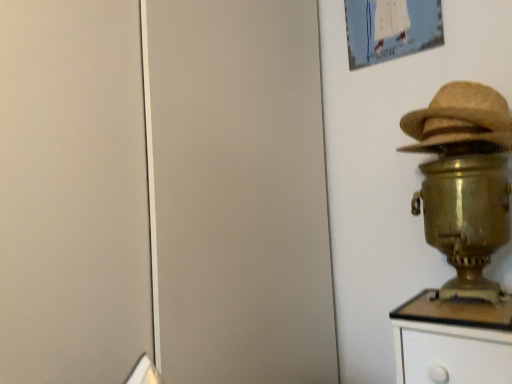
Question: Would you say gold metallic samovar at right is outside matte paper picture frame at upper right?

Choices:
 (A) no
 (B) yes

Answer: (B)

Question: Does gold metallic samovar at right have a lesser height compared to matte paper picture frame at upper right?

Choices:
 (A) no
 (B) yes

Answer: (A)

Question: Can you confirm if gold metallic samovar at right is thinner than matte paper picture frame at upper right?

Choices:
 (A) no
 (B) yes

Answer: (A)

Question: Does gold metallic samovar at right have a larger size compared to matte paper picture frame at upper right?

Choices:
 (A) yes
 (B) no

Answer: (A)

Question: Is gold metallic samovar at right closer to the viewer compared to matte paper picture frame at upper right?

Choices:
 (A) no
 (B) yes

Answer: (B)

Question: Choose the correct answer: Is gold metallic samovar at right inside braided straw hat at right or outside it?

Choices:
 (A) inside
 (B) outside

Answer: (B)

Question: Is gold metallic samovar at right taller or shorter than braided straw hat at right?

Choices:
 (A) short
 (B) tall

Answer: (B)

Question: Is point [488, 182] closer or farther from the camera than point [418, 120]?

Choices:
 (A) farther
 (B) closer

Answer: (B)

Question: In the image, is gold metallic samovar at right positioned in front of or behind braided straw hat at right?

Choices:
 (A) behind
 (B) front

Answer: (B)

Question: Considering the positions of gold metallic samovar at right and matte paper picture frame at upper right in the image, is gold metallic samovar at right taller or shorter than matte paper picture frame at upper right?

Choices:
 (A) tall
 (B) short

Answer: (A)

Question: From a real-world perspective, relative to matte paper picture frame at upper right, is gold metallic samovar at right vertically above or below?

Choices:
 (A) above
 (B) below

Answer: (B)

Question: Is gold metallic samovar at right wider or thinner than matte paper picture frame at upper right?

Choices:
 (A) wide
 (B) thin

Answer: (A)

Question: Is gold metallic samovar at right in front of or behind matte paper picture frame at upper right in the image?

Choices:
 (A) behind
 (B) front

Answer: (B)

Question: From a real-world perspective, is braided straw hat at right above or below gold metallic samovar at right?

Choices:
 (A) below
 (B) above

Answer: (B)

Question: Is braided straw hat at right bigger or smaller than gold metallic samovar at right?

Choices:
 (A) big
 (B) small

Answer: (B)